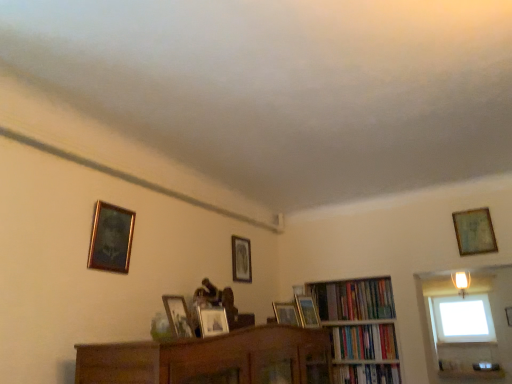
Question: From the image's perspective, is wooden picture frame at center, arranged as the 4th picture frame when viewed from the left, on gold-framed painting at upper left, the sixth picture frame viewed from the right?

Choices:
 (A) yes
 (B) no

Answer: (B)

Question: Can you confirm if wooden picture frame at center, which appears as the 3th picture frame when viewed from the front, is thinner than gold-framed painting at upper left, marked as the first picture frame in a left-to-right arrangement?

Choices:
 (A) no
 (B) yes

Answer: (A)

Question: Is wooden picture frame at center, which ranks as the 3th picture frame in right-to-left order, not within gold-framed painting at upper left, which appears as the second picture frame when viewed from the front?

Choices:
 (A) no
 (B) yes

Answer: (B)

Question: Is wooden picture frame at center, which ranks as the 3th picture frame in right-to-left order, to the left of gold-framed painting at upper left, which appears as the second picture frame when viewed from the front, from the viewer's perspective?

Choices:
 (A) no
 (B) yes

Answer: (A)

Question: Is wooden picture frame at center, which appears as the 3th picture frame when viewed from the front, smaller than gold-framed painting at upper left, arranged as the fifth picture frame when viewed from the back?

Choices:
 (A) no
 (B) yes

Answer: (B)

Question: Is wooden picture frame at center, which appears as the 3th picture frame when viewed from the front, next to gold-framed painting at upper left, the sixth picture frame viewed from the right, and touching it?

Choices:
 (A) no
 (B) yes

Answer: (A)

Question: Does transparent glass window at upper right have a greater height compared to hardcover books at upper right, the first book positioned from the top?

Choices:
 (A) yes
 (B) no

Answer: (A)

Question: Is transparent glass window at upper right closer to camera compared to hardcover books at upper right, the first book positioned from the top?

Choices:
 (A) yes
 (B) no

Answer: (B)

Question: From a real-world perspective, is transparent glass window at upper right on top of hardcover books at upper right, the first book positioned from the top?

Choices:
 (A) yes
 (B) no

Answer: (B)

Question: Does transparent glass window at upper right have a smaller size compared to hardcover books at upper right, the first book positioned from the top?

Choices:
 (A) yes
 (B) no

Answer: (B)

Question: Considering the relative positions of transparent glass window at upper right and hardcover books at upper right, the 3th book ordered from the bottom, in the image provided, is transparent glass window at upper right to the right of hardcover books at upper right, the 3th book ordered from the bottom, from the viewer's perspective?

Choices:
 (A) yes
 (B) no

Answer: (A)

Question: Does transparent glass window at upper right have a lesser height compared to hardcover books at upper right, the 3th book ordered from the bottom?

Choices:
 (A) yes
 (B) no

Answer: (B)

Question: From a real-world perspective, is wooden picture frame at center, which ranks as the 3th picture frame in right-to-left order, located higher than wooden photo frame at center, the second picture frame when ordered from left to right?

Choices:
 (A) no
 (B) yes

Answer: (A)